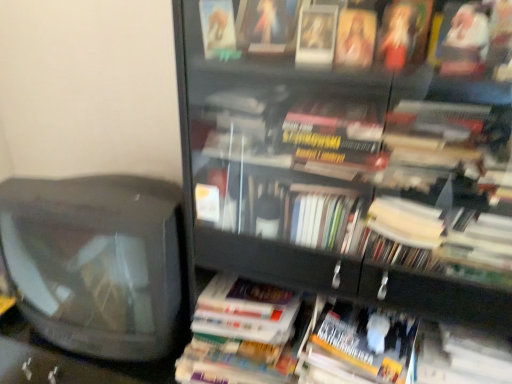
Question: Considering the relative sizes of transparent glass bookcase at center and yellow matte paperback book at lower right, which is the 2th paperback book from left to right, in the image provided, is transparent glass bookcase at center smaller than yellow matte paperback book at lower right, which is the 2th paperback book from left to right,?

Choices:
 (A) no
 (B) yes

Answer: (A)

Question: Is transparent glass bookcase at center far away from yellow matte paperback book at lower right, which is the 2th paperback book from left to right?

Choices:
 (A) no
 (B) yes

Answer: (A)

Question: Considering the relative sizes of transparent glass bookcase at center and yellow matte paperback book at lower right, which is the 2th paperback book from left to right, in the image provided, is transparent glass bookcase at center taller than yellow matte paperback book at lower right, which is the 2th paperback book from left to right,?

Choices:
 (A) yes
 (B) no

Answer: (A)

Question: Considering the relative positions of transparent glass bookcase at center and yellow matte paperback book at lower right, which is the 2th paperback book from left to right, in the image provided, is transparent glass bookcase at center to the left of yellow matte paperback book at lower right, which is the 2th paperback book from left to right, from the viewer's perspective?

Choices:
 (A) no
 (B) yes

Answer: (B)

Question: From a real-world perspective, is transparent glass bookcase at center positioned under yellow matte paperback book at lower right, which is the 2th paperback book from left to right, based on gravity?

Choices:
 (A) no
 (B) yes

Answer: (A)

Question: Is point (241, 367) positioned closer to the camera than point (354, 317)?

Choices:
 (A) closer
 (B) farther

Answer: (B)

Question: Visually, is hardcover book at center, positioned as the 1th paperback book in left-to-right order, positioned to the left or to the right of yellow matte paperback book at lower right, which is the 2th paperback book from left to right?

Choices:
 (A) left
 (B) right

Answer: (A)

Question: From a real-world perspective, is hardcover book at center, positioned as the 1th paperback book in left-to-right order, positioned above or below yellow matte paperback book at lower right, which is the 2th paperback book from left to right?

Choices:
 (A) below
 (B) above

Answer: (B)

Question: Looking at their shapes, would you say hardcover book at center, positioned as the 1th paperback book in left-to-right order, is wider or thinner than yellow matte paperback book at lower right, which appears as the first paperback book when viewed from the right?

Choices:
 (A) thin
 (B) wide

Answer: (B)

Question: Considering the positions of transparent glass bookcase at center and yellow matte paperback book at lower right, which is the 2th paperback book from left to right, in the image, is transparent glass bookcase at center bigger or smaller than yellow matte paperback book at lower right, which is the 2th paperback book from left to right,?

Choices:
 (A) big
 (B) small

Answer: (A)

Question: Visually, is transparent glass bookcase at center positioned to the left or to the right of yellow matte paperback book at lower right, which is the 2th paperback book from left to right?

Choices:
 (A) right
 (B) left

Answer: (B)

Question: Is point (216, 13) closer or farther from the camera than point (351, 337)?

Choices:
 (A) closer
 (B) farther

Answer: (A)

Question: From the image's perspective, is transparent glass bookcase at center located above or below yellow matte paperback book at lower right, which appears as the first paperback book when viewed from the right?

Choices:
 (A) below
 (B) above

Answer: (B)

Question: Is hardcover book at center, positioned as the 1th paperback book in left-to-right order, wider or thinner than transparent glass bookcase at center?

Choices:
 (A) wide
 (B) thin

Answer: (B)

Question: Is point (246, 309) closer or farther from the camera than point (236, 29)?

Choices:
 (A) closer
 (B) farther

Answer: (B)